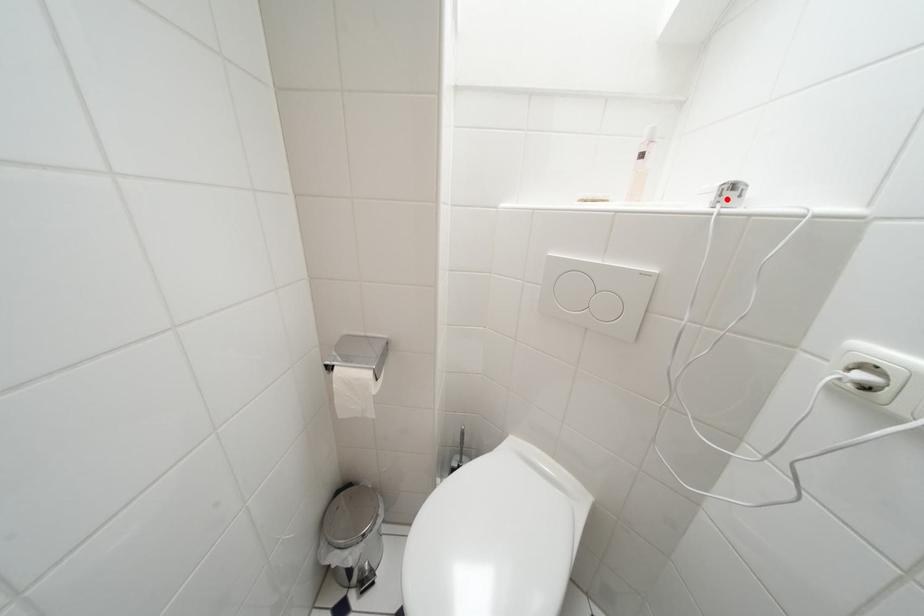
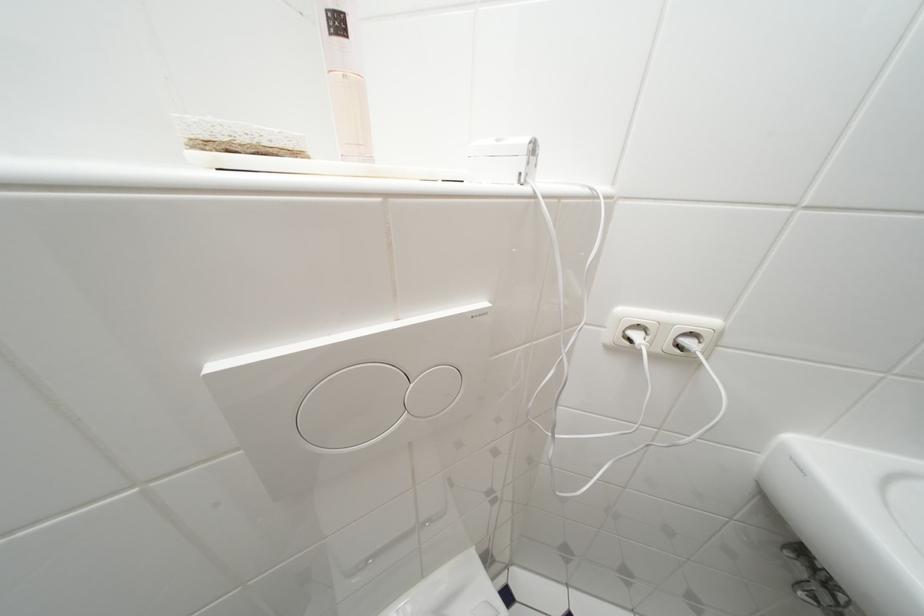
The point at the highlighted location is marked in the first image. Where is the corresponding point in the second image?

(535, 166)